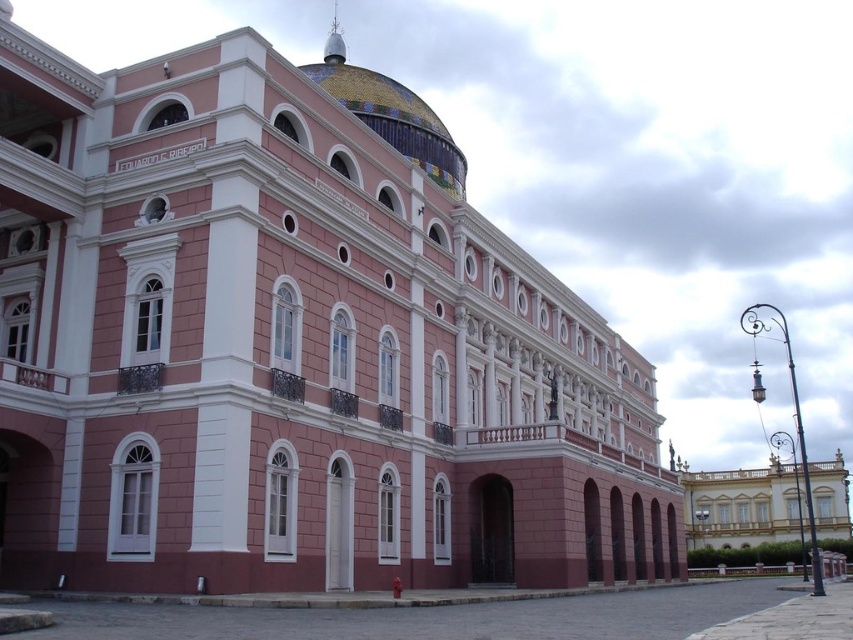
Between golden ornate palace at right and multicolored mosaic dome at upper center, which one has less height?

golden ornate palace at right is shorter.

Does point (706, 531) come behind point (457, 176)?

Yes, it is.

Image resolution: width=853 pixels, height=640 pixels. I want to click on golden ornate palace at right, so click(741, 506).